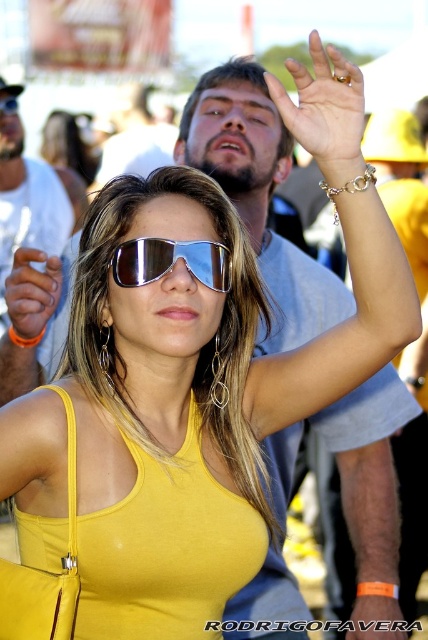
Question: Is matte white shirt at upper center thinner than matte black sunglasses at upper center?

Choices:
 (A) no
 (B) yes

Answer: (A)

Question: Is sunglasses at center wider than matte black sunglasses at upper center?

Choices:
 (A) no
 (B) yes

Answer: (B)

Question: Is matte white shirt at upper center to the left of sunglasses at center from the viewer's perspective?

Choices:
 (A) no
 (B) yes

Answer: (B)

Question: Among these points, which one is farthest from the camera?

Choices:
 (A) (168, 268)
 (B) (29, 212)
 (C) (0, 100)

Answer: (B)

Question: Which of the following is the farthest from the observer?

Choices:
 (A) sunglasses at center
 (B) matte white shirt at upper center
 (C) matte black sunglasses at upper center

Answer: (C)

Question: Based on their relative distances, which object is farther from the sunglasses at center?

Choices:
 (A) matte white shirt at upper center
 (B) matte black sunglasses at upper center

Answer: (B)